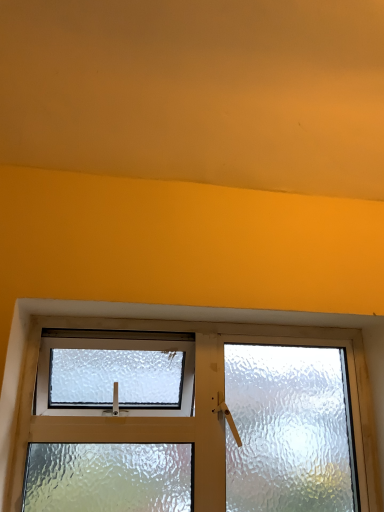
This screenshot has height=512, width=384. Describe the element at coordinates (196, 402) in the screenshot. I see `clear glass door at bottom` at that location.

Locate an element on the screen. This screenshot has height=512, width=384. clear glass door at bottom is located at coordinates (196, 402).

What is the approximate height of clear glass door at bottom?

21.20 inches.

Find the location of a particular element. The height and width of the screenshot is (512, 384). clear glass door at bottom is located at coordinates point(196,402).